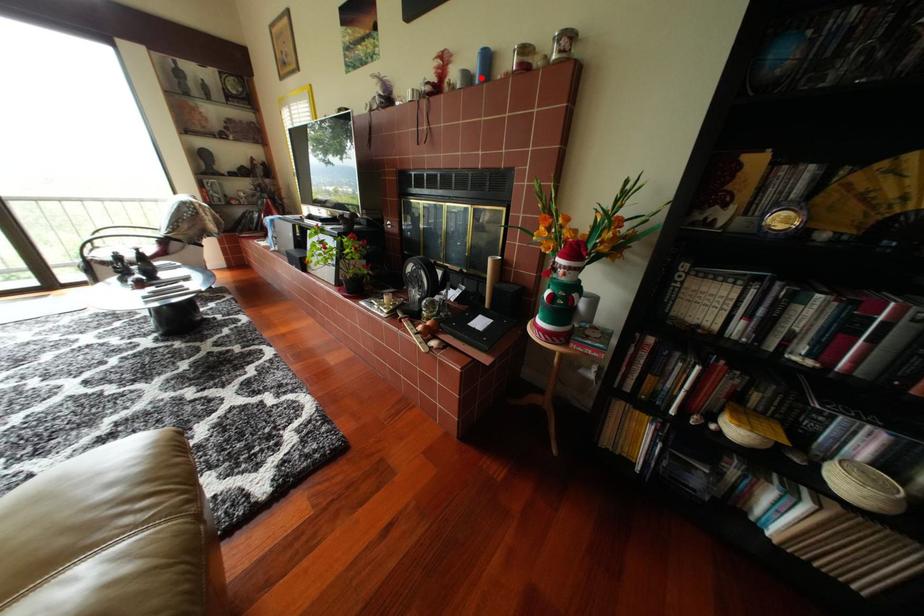
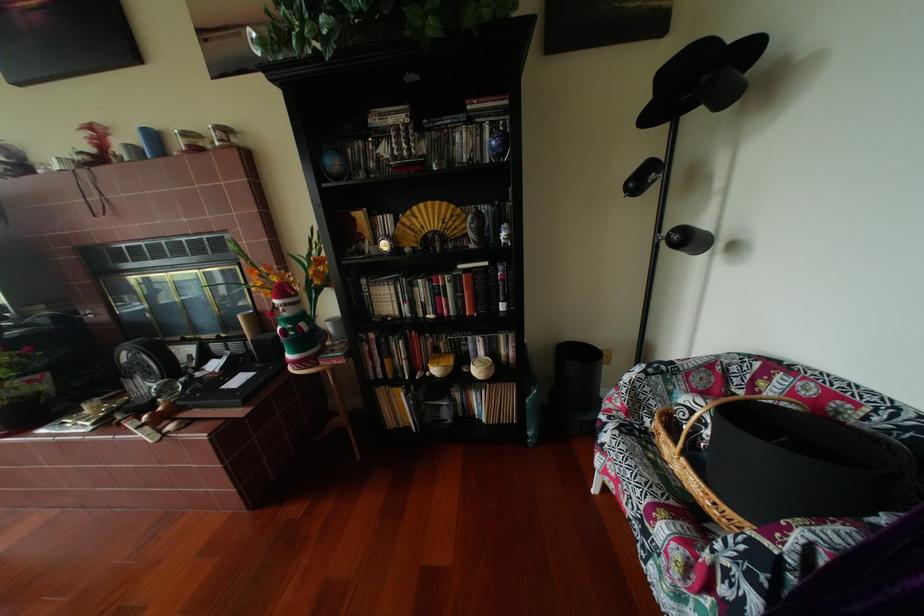
Question: I am providing you with two images of the same scene from different viewpoints. A red point is marked on the first image. Is the red point's position out of view in image 2?

Choices:
 (A) Yes
 (B) No

Answer: (B)